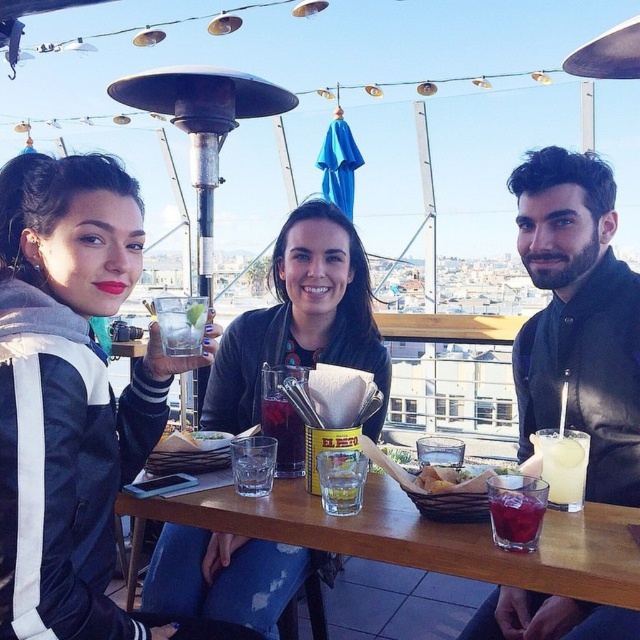
You are a server at the rooftop bar and need to place a new order of drinks on the table. The drinks come in a tray that takes up the same amount of space as the yellow paper at center. Is there enough space on the table next to the black leather jacket at upper right to place the tray?

The black leather jacket at upper right has a larger size compared to yellow paper at center. Since the tray takes up the same space as the yellow paper at center, and the jacket is larger, there should be sufficient space next to the black leather jacket at upper right to place the tray.

You are a server at the rooftop bar and need to place a new drink order for the guests. The black leather jacket at upper right and the yellow paper at center are on the table. Where should you place the new drink to avoid covering any items?

The black leather jacket at upper right is positioned over the yellow paper at center, so you should place the new drink in an uncovered area of the table, away from where the jacket and paper are placed.

Based on the photo, you are a server at the rooftop bar and need to deliver a drink to the customer. The drink must be placed on the table between the black leather jacket at upper right and the yellow paper at center. Is there enough space between them to place the drink?

The black leather jacket at upper right and the yellow paper at center are 30.28 inches apart, so there is sufficient space to place the drink between them.